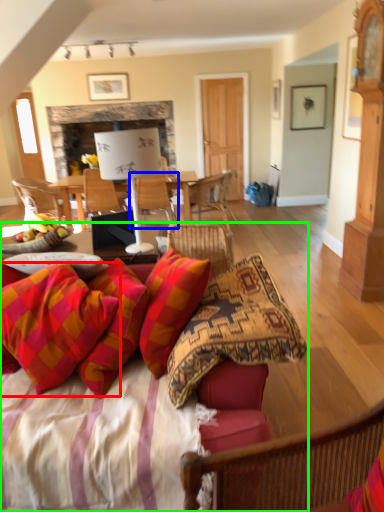
Question: Which is nearer to the pillow (highlighted by a red box)? chair (highlighted by a blue box) or studio couch (highlighted by a green box).

Choices:
 (A) chair
 (B) studio couch

Answer: (B)